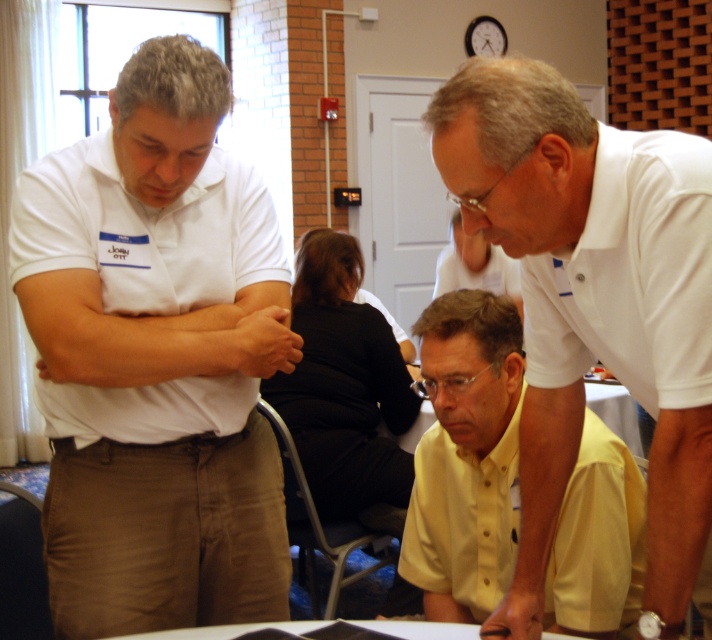
In the scene shown: Who is lower down, white matte shirt at left or yellow button-down shirt at lower center?

yellow button-down shirt at lower center

Between point (110, 333) and point (525, 490), which one is positioned behind?

Point (110, 333)

Where is `white matte shirt at left`? white matte shirt at left is located at coordinates (152, 333).

Does white smooth shirt at right have a smaller size compared to matte white shirt at center?

Yes, white smooth shirt at right is smaller than matte white shirt at center.

Which is in front, point (689, 448) or point (478, 260)?

Point (689, 448) is in front.

I want to click on white smooth shirt at right, so click(679, 401).

Is black fabric shirt at center positioned at the back of matte white shirt at center?

No.

Does point (394, 342) lie behind point (464, 252)?

No, it is not.

Is point (333, 492) behind point (513, 276)?

No.

This screenshot has width=712, height=640. What are the coordinates of `black fabric shirt at center` in the screenshot? It's located at (342, 385).